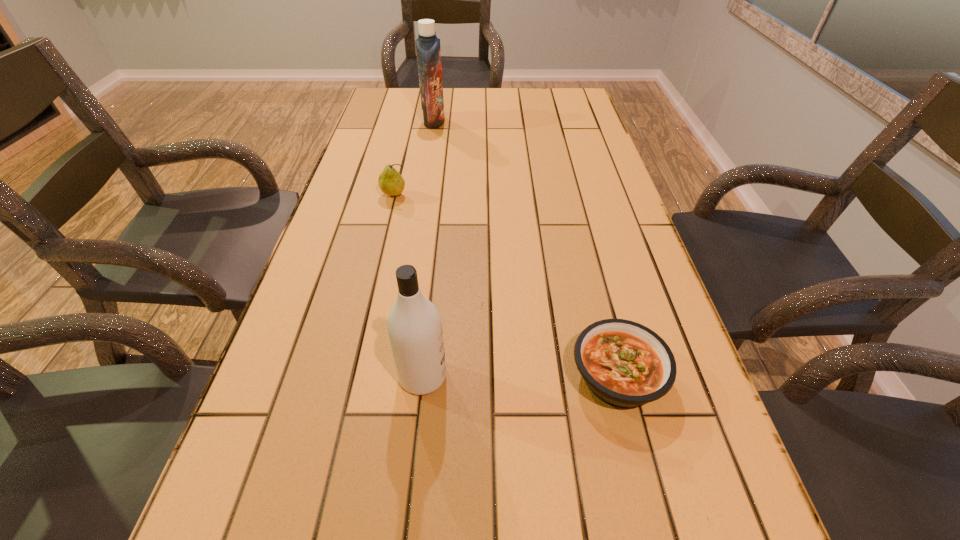
Find the location of `free area in between the stew and the farther shampoo`. free area in between the stew and the farther shampoo is located at coordinates (526, 249).

Image resolution: width=960 pixels, height=540 pixels. In order to click on blank region between the leftmost object and the stew in this screenshot , I will do `click(506, 286)`.

The height and width of the screenshot is (540, 960). I want to click on empty space that is in between the leftmost object and the shortest object, so click(506, 286).

Image resolution: width=960 pixels, height=540 pixels. What are the coordinates of `vacant space that is in between the stew and the farther shampoo` in the screenshot? It's located at (526, 249).

Find the location of a particular element. The image size is (960, 540). vacant area between the shorter shampoo and the stew is located at coordinates (520, 376).

Locate an element on the screen. empty space that is in between the shorter shampoo and the stew is located at coordinates (520, 376).

The height and width of the screenshot is (540, 960). I want to click on free space between the stew and the leftmost object, so click(506, 286).

You are a GUI agent. You are given a task and a screenshot of the screen. Output one action in this format:
    pyautogui.click(x=<x>, y=<y>)
    Task: Click on the vacant space that is in between the farthest object and the stew
    Image resolution: width=960 pixels, height=540 pixels.
    Given the screenshot: What is the action you would take?
    pyautogui.click(x=526, y=249)

Find the location of a particular element. Image resolution: width=960 pixels, height=540 pixels. free spot between the farther shampoo and the rightmost object is located at coordinates (526, 249).

Choose which object is the nearest neighbor to the stew. Please provide its 2D coordinates. Your answer should be formatted as a tuple, i.e. [(x, y)], where the tuple contains the x and y coordinates of a point satisfying the conditions above.

[(414, 325)]